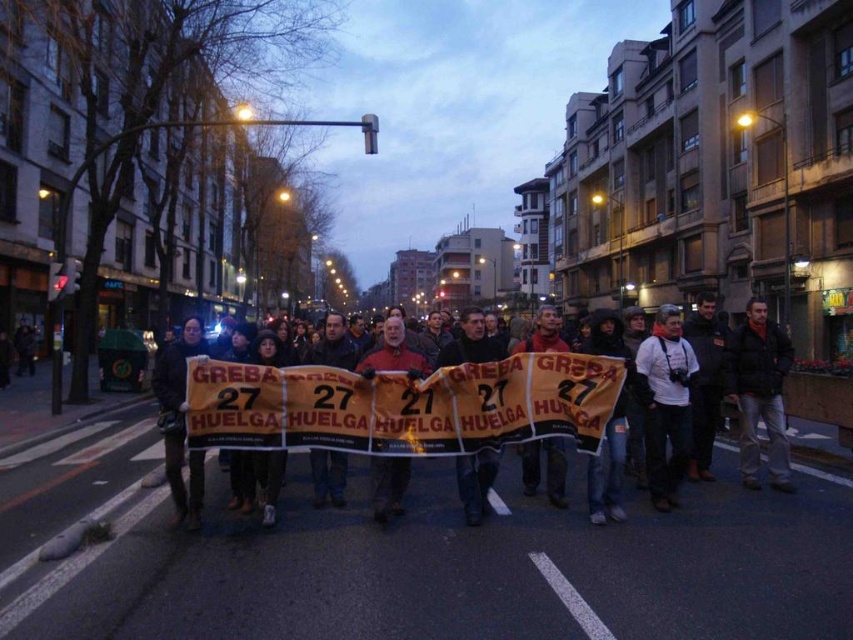
Question: Does dark blue jacket at right appear on the right side of reddish-brown leather jacket at center?

Choices:
 (A) yes
 (B) no

Answer: (A)

Question: Which of the following is the farthest from the observer?

Choices:
 (A) (392, 337)
 (B) (766, 401)
 (C) (598, 388)
 (D) (666, 493)

Answer: (B)

Question: Is orange fabric banner at center to the left of white fabric camera at center from the viewer's perspective?

Choices:
 (A) yes
 (B) no

Answer: (A)

Question: Can you confirm if orange fabric banner at center is smaller than white fabric camera at center?

Choices:
 (A) yes
 (B) no

Answer: (B)

Question: Which of the following is the closest to the observer?

Choices:
 (A) (648, 416)
 (B) (392, 493)

Answer: (B)

Question: Which point is closer to the camera taking this photo?

Choices:
 (A) (665, 500)
 (B) (374, 513)
 (C) (577, 380)
 (D) (776, 486)

Answer: (C)